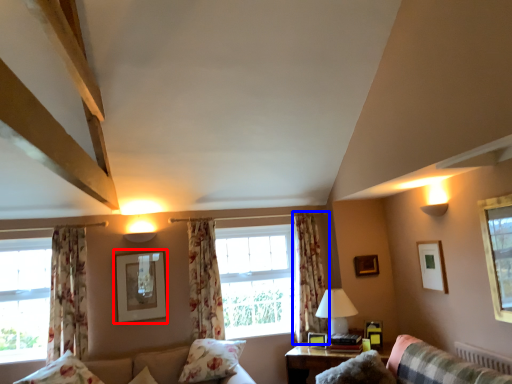
Question: Which object appears farthest to the camera in this image, picture frame (highlighted by a red box) or curtain (highlighted by a blue box)?

Choices:
 (A) picture frame
 (B) curtain

Answer: (B)